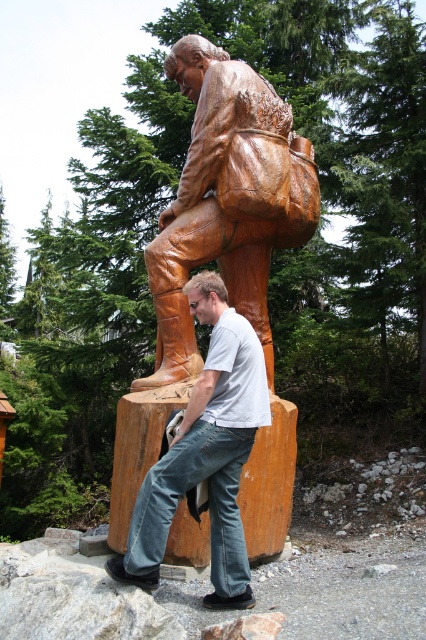
Which is below, wooden carved figure at center or natural wood log at center?

Positioned lower is natural wood log at center.

I want to click on wooden carved figure at center, so click(x=227, y=200).

You are a GUI agent. You are given a task and a screenshot of the screen. Output one action in this format:
    pyautogui.click(x=<x>, y=<y>)
    Task: Click on the wooden carved figure at center
    This screenshot has width=426, height=640.
    Given the screenshot: What is the action you would take?
    pyautogui.click(x=227, y=200)

Is matte brown boot at center thinner than natural wood log at center?

No.

Is point (222, 348) closer to camera compared to point (134, 465)?

Yes, point (222, 348) is in front of point (134, 465).

Does point (268, 408) come behind point (264, 442)?

That is False.

Image resolution: width=426 pixels, height=640 pixels. Find the location of `matte brown boot at center`. matte brown boot at center is located at coordinates (206, 452).

Describe the element at coordinates (227, 200) in the screenshot. This screenshot has width=426, height=640. I see `wooden carved figure at center` at that location.

Locate an element on the screen. wooden carved figure at center is located at coordinates pyautogui.click(x=227, y=200).